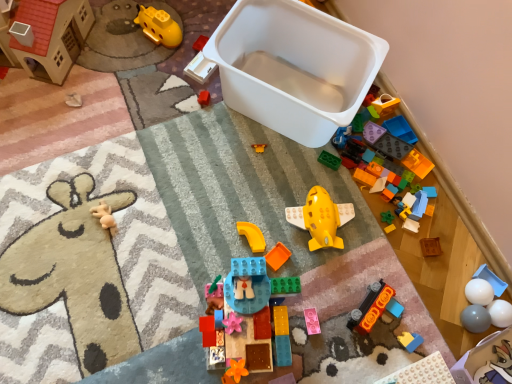
Identify the location of free spot behind white glossy ball at lower right, the fifteenth toy in the left-to-right sequence. (459, 245).